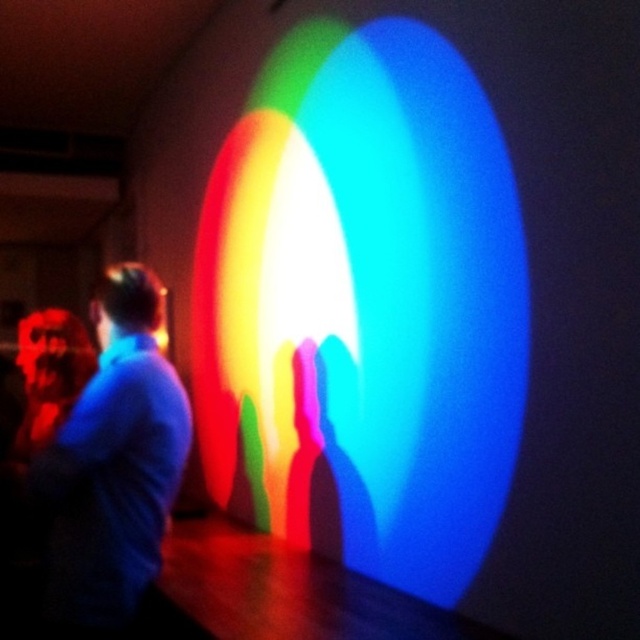
Question: Can you confirm if translucent rainbow light at center is bigger than blue fabric shirt at left?

Choices:
 (A) yes
 (B) no

Answer: (A)

Question: Which object appears closest to the camera in this image?

Choices:
 (A) blue fabric shirt at left
 (B) translucent rainbow light at center

Answer: (A)

Question: Is translucent rainbow light at center positioned behind blue fabric shirt at left?

Choices:
 (A) no
 (B) yes

Answer: (B)

Question: Does translucent rainbow light at center appear over blue fabric shirt at left?

Choices:
 (A) no
 (B) yes

Answer: (B)

Question: Which point appears farthest from the camera in this image?

Choices:
 (A) (257, 365)
 (B) (163, 378)

Answer: (A)

Question: Which point is farther from the camera taking this photo?

Choices:
 (A) (413, 326)
 (B) (140, 420)

Answer: (A)